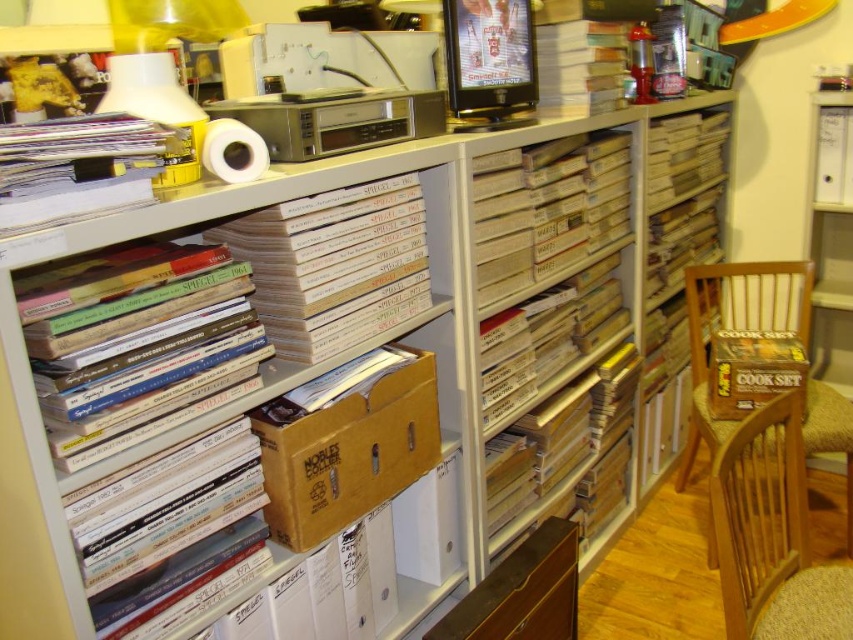
Question: Which object appears closest to the camera in this image?

Choices:
 (A) beige cardboard box at center
 (B) brown cardboard box at center

Answer: (B)

Question: Is brown cardboard box at center to the left of wooden chair at right from the viewer's perspective?

Choices:
 (A) no
 (B) yes

Answer: (B)

Question: Which of these objects is positioned farthest from the brown cardboard box at center?

Choices:
 (A) brown cardboard box at right
 (B) brown wooden chair at lower right
 (C) wooden drawer at center

Answer: (A)

Question: Among these points, which one is farthest from the camera?

Choices:
 (A) coord(141,360)
 (B) coord(836,413)

Answer: (B)

Question: In this image, where is hardcover books at left located relative to wooden chair at right?

Choices:
 (A) above
 (B) below

Answer: (A)

Question: In this image, where is brown cardboard box at center located relative to beige cardboard box at center?

Choices:
 (A) below
 (B) above

Answer: (A)